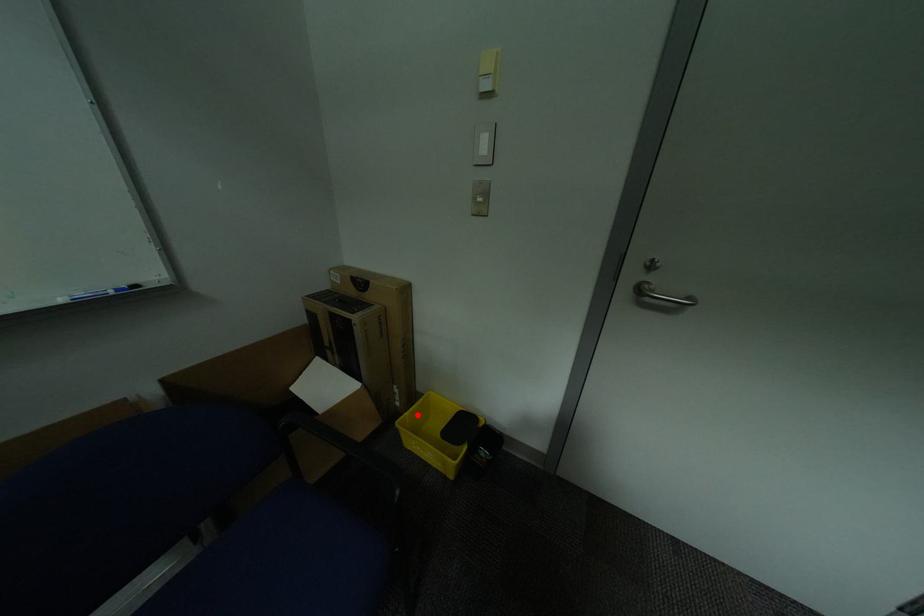
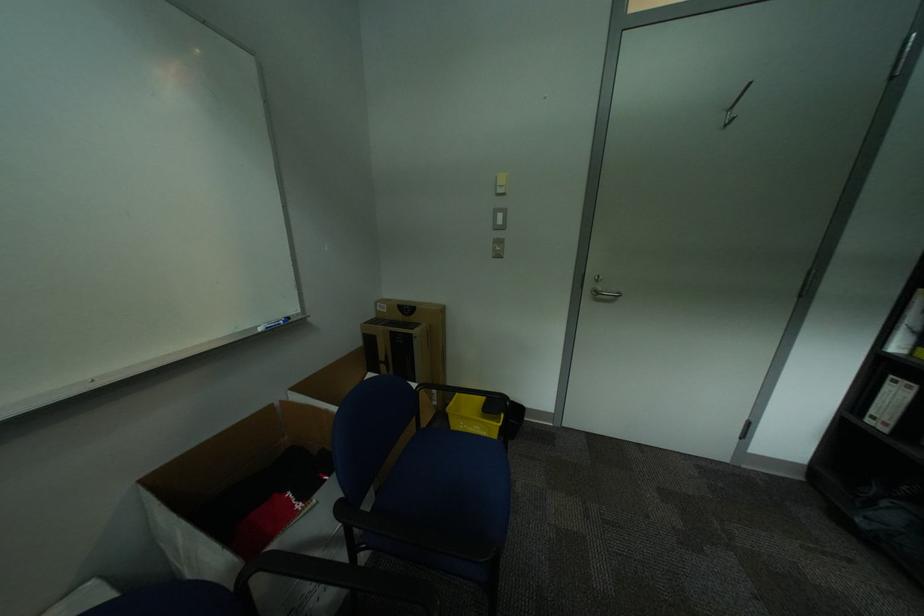
Question: I am providing you with two images of the same scene from different viewpoints. Image1 has a red point marked. In image2, the corresponding 3D location appears at what relative position? Reply with the corresponding letter.

Choices:
 (A) Closer
 (B) Farther

Answer: (B)